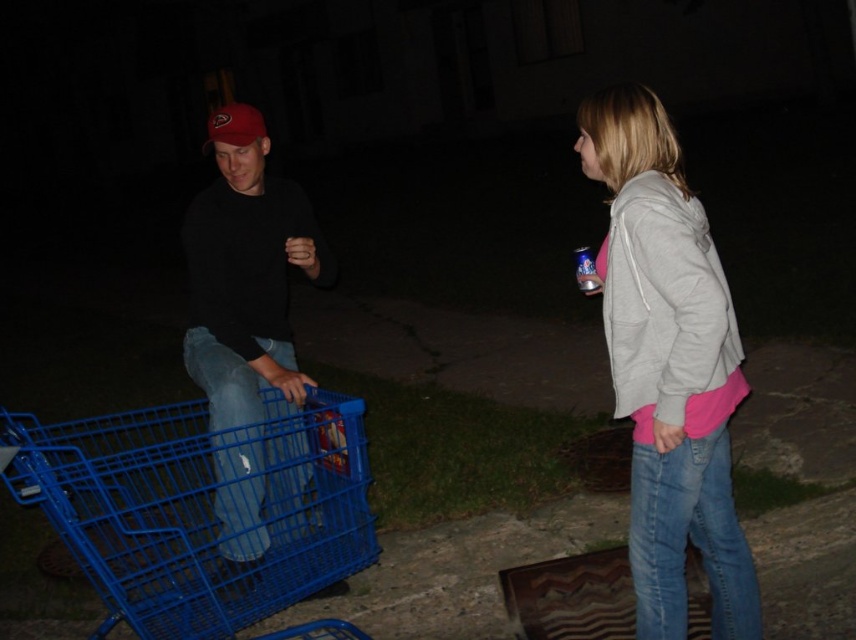
You are a delivery person trying to locate the recipient of a package. You see a light gray hoodie at upper right and a matte black shirt at center. Which clothing item is closer to you, the delivery person?

The light gray hoodie at upper right is closer to you because it is in front of the matte black shirt at center.

You are trying to navigate through the scene shown. You need to move from the blue plastic shopping cart at lower left to the light gray hoodie at upper right. Considering their sizes, which object might you need to avoid bumping into more?

The blue plastic shopping cart at lower left might be wider than the light gray hoodie at upper right, so you should be more cautious of bumping into the blue plastic shopping cart at lower left.